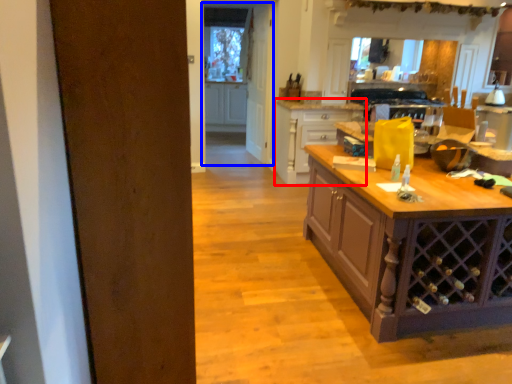
Question: Which of the following is the farthest to the observer, cabinetry (highlighted by a red box) or glass door (highlighted by a blue box)?

Choices:
 (A) cabinetry
 (B) glass door

Answer: (B)